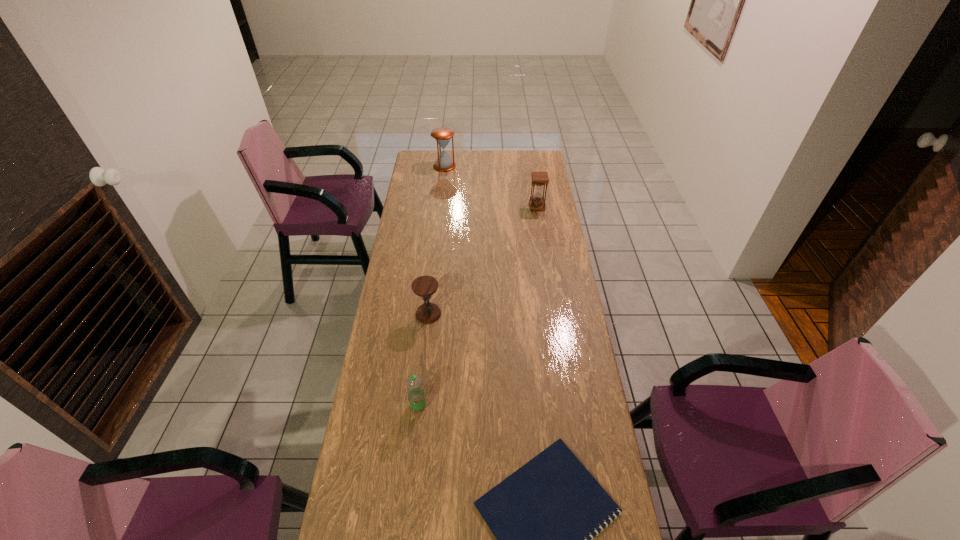
The width and height of the screenshot is (960, 540). Identify the location of the farthest hourglass. (442, 135).

This screenshot has height=540, width=960. I want to click on the fourth nearest object, so click(x=537, y=202).

The width and height of the screenshot is (960, 540). I want to click on the second nearest hourglass, so click(x=537, y=202).

This screenshot has width=960, height=540. I want to click on water bottle, so click(416, 395).

Locate an element on the screen. The image size is (960, 540). the third nearest object is located at coordinates (424, 286).

This screenshot has height=540, width=960. Identify the location of free space located on the front of the farthest hourglass. (440, 212).

The height and width of the screenshot is (540, 960). In order to click on free space located on the back of the second nearest hourglass in this screenshot , I will do `click(531, 166)`.

You are a GUI agent. You are given a task and a screenshot of the screen. Output one action in this format:
    pyautogui.click(x=<x>, y=<y>)
    Task: Click on the vacant space located on the back of the water bottle
    
    Given the screenshot: What is the action you would take?
    [x=425, y=341]

Find the location of a particular element. vacant space located on the left of the third farthest object is located at coordinates (403, 314).

Identify the location of object that is at the far edge. (442, 135).